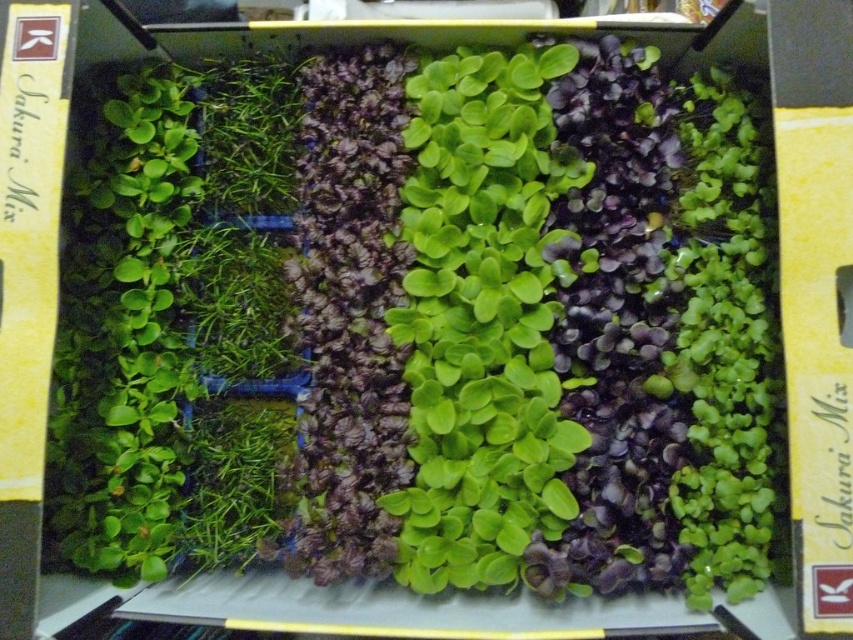
Which is in front, point (519, 392) or point (277, 115)?

Point (519, 392) is more forward.

Can you confirm if green matte leafy plant at center is positioned above green leafy plant at upper left?

No.

Where is `green matte leafy plant at center`? green matte leafy plant at center is located at coordinates (482, 320).

Based on the photo, who is lower down, green matte leafy plant at right or green leafy plant at upper left?

green matte leafy plant at right is lower down.

Measure the distance between green matte leafy plant at right and camera.

The distance of green matte leafy plant at right from camera is 37.88 inches.

Where is `green matte leafy plant at right`? The width and height of the screenshot is (853, 640). green matte leafy plant at right is located at coordinates (724, 340).

Can you confirm if green matte leafy plant at center is shorter than green leafy plant at center?

In fact, green matte leafy plant at center may be taller than green leafy plant at center.

Can you confirm if green matte leafy plant at center is smaller than green leafy plant at center?

No, green matte leafy plant at center is not smaller than green leafy plant at center.

This screenshot has width=853, height=640. I want to click on green matte leafy plant at center, so click(482, 320).